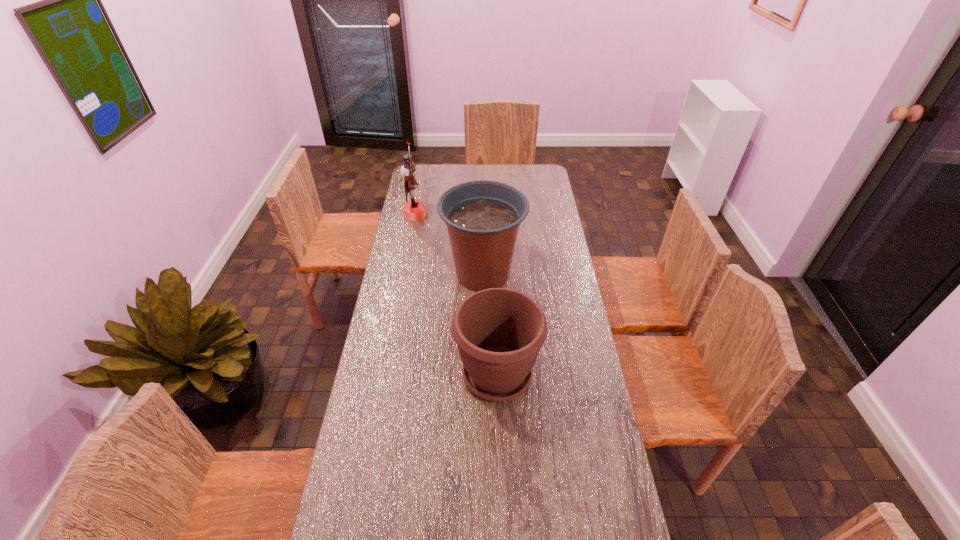
This screenshot has width=960, height=540. In order to click on blank space that satisfies the following two spatial constraints: 1. on the front-facing side of the shorter flowerpot; 2. on the right side of the farthest object in this screenshot , I will do `click(386, 374)`.

Identify the location of vacant position in the image that satisfies the following two spatial constraints: 1. on the front-facing side of the leftmost object; 2. on the back side of the taller flowerpot. This screenshot has width=960, height=540. (404, 274).

What are the coordinates of `vacant space that satisfies the following two spatial constraints: 1. on the front-facing side of the leftmost object; 2. on the back side of the taller flowerpot` in the screenshot? It's located at (404, 274).

Identify the location of blank area in the image that satisfies the following two spatial constraints: 1. on the front-facing side of the nearest object; 2. on the left side of the leftmost object. (386, 374).